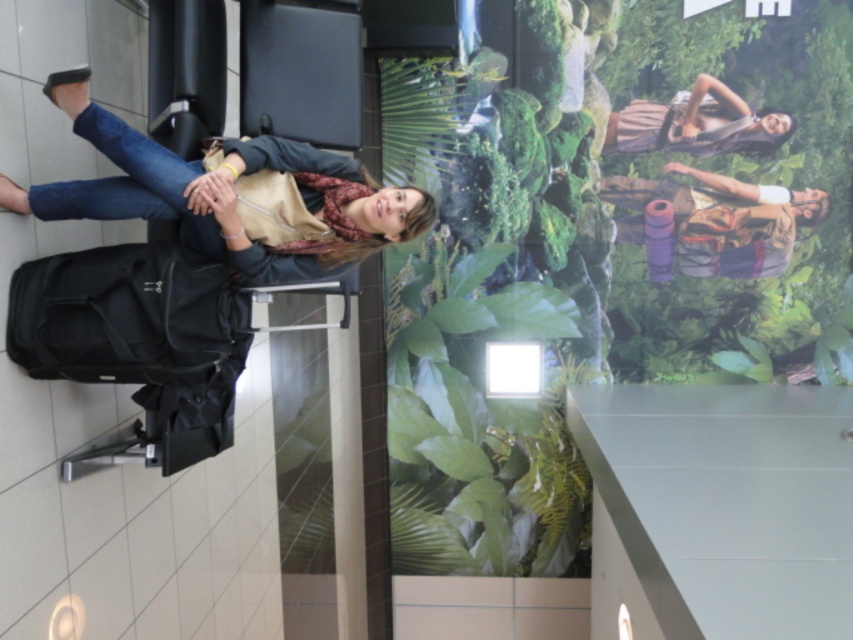
Question: Can you confirm if black fabric suitcase at lower left is positioned below brown textured dress at upper right?

Choices:
 (A) no
 (B) yes

Answer: (B)

Question: Does matte black suitcase at left lie behind brown textured dress at upper right?

Choices:
 (A) yes
 (B) no

Answer: (B)

Question: Which point appears closest to the camera in this image?

Choices:
 (A) (270, 184)
 (B) (33, 307)

Answer: (B)

Question: Which object is positioned closest to the brown textured dress at upper right?

Choices:
 (A) black fabric suitcase at lower left
 (B) matte black suitcase at left
 (C) purple fabric backpack at upper right

Answer: (C)

Question: Which object is closer to the camera taking this photo?

Choices:
 (A) brown textured dress at upper right
 (B) black fabric suitcase at lower left
 (C) matte black suitcase at left

Answer: (C)

Question: Is matte black suitcase at left smaller than brown textured dress at upper right?

Choices:
 (A) no
 (B) yes

Answer: (A)